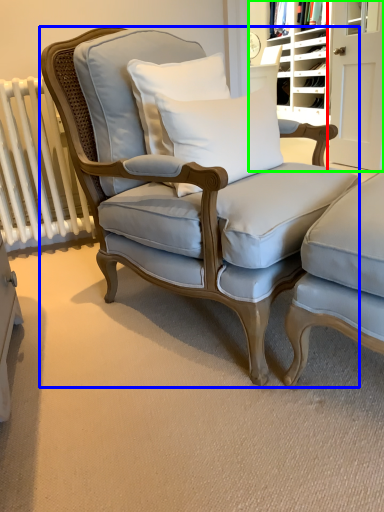
Question: Which is nearer to the door (highlighted by a red box)? chair (highlighted by a blue box) or bookshelf (highlighted by a green box).

Choices:
 (A) chair
 (B) bookshelf

Answer: (B)